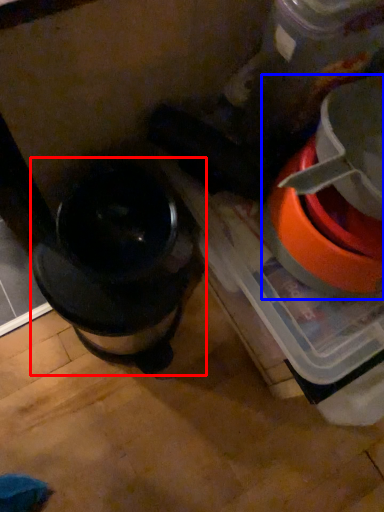
Question: Which point is closer to the camera, kitchen appliance (highlighted by a red box) or appliance (highlighted by a blue box)?

Choices:
 (A) kitchen appliance
 (B) appliance

Answer: (B)